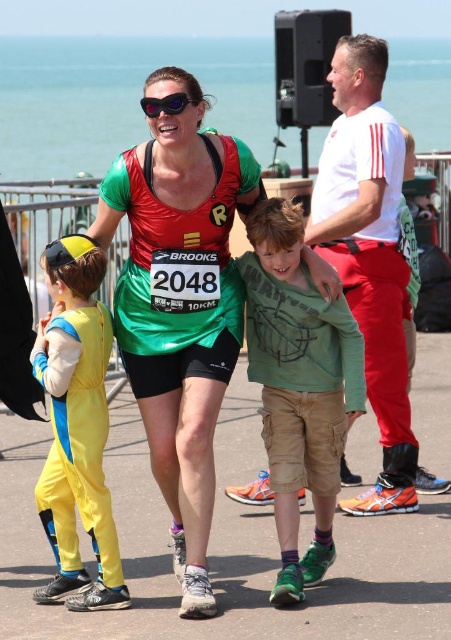
Question: Does matte green tank top at center appear on the right side of green cotton shirt at center?

Choices:
 (A) yes
 (B) no

Answer: (B)

Question: Considering the relative positions of matte green tank top at center and purple reflective sunglasses at center in the image provided, where is matte green tank top at center located with respect to purple reflective sunglasses at center?

Choices:
 (A) above
 (B) below

Answer: (B)

Question: Which object appears farthest from the camera in this image?

Choices:
 (A) purple reflective sunglasses at center
 (B) yellow/blue fabric jumpsuit at left
 (C) green cotton shirt at center

Answer: (A)

Question: Which of these objects is positioned closest to the matte green tank top at center?

Choices:
 (A) yellow/blue fabric jumpsuit at left
 (B) green cotton shirt at center
 (C) purple reflective sunglasses at center

Answer: (B)

Question: Which point is farther to the camera?

Choices:
 (A) matte green tank top at center
 (B) purple reflective sunglasses at center
 (C) yellow/blue fabric jumpsuit at left

Answer: (B)

Question: Observing the image, what is the correct spatial positioning of yellow/blue fabric jumpsuit at left in reference to purple reflective sunglasses at center?

Choices:
 (A) left
 (B) right

Answer: (A)